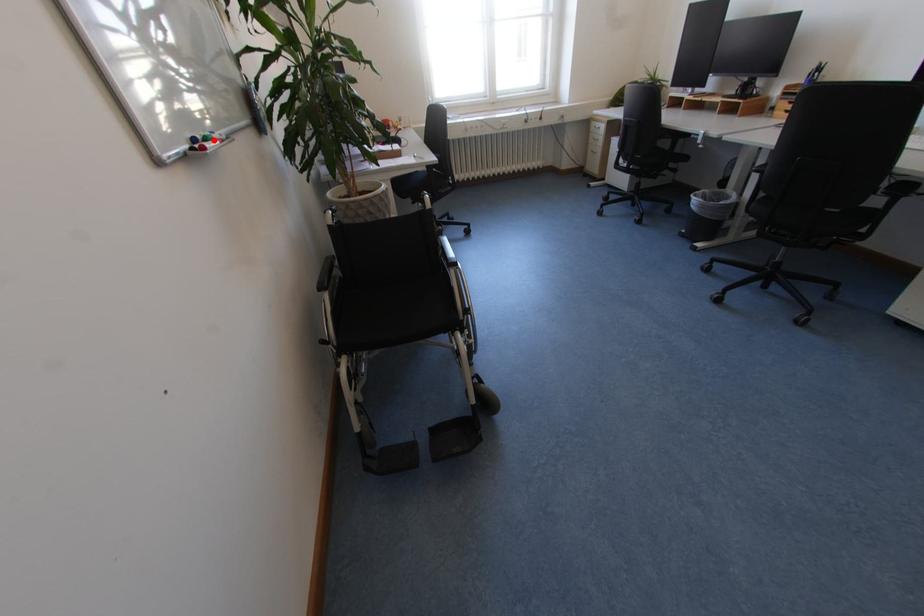
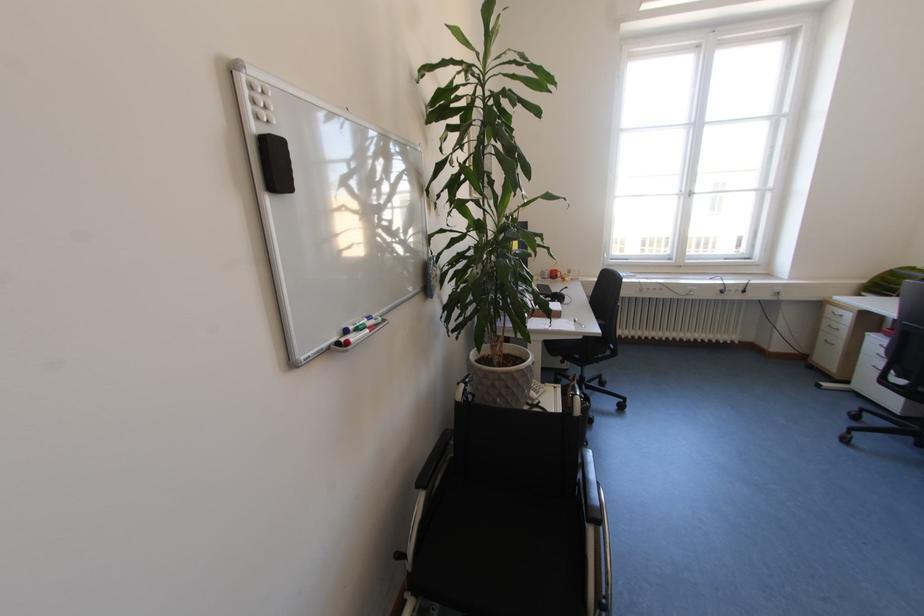
The point at the highlighted location is marked in the first image. Where is the corresponding point in the second image?

(366, 330)